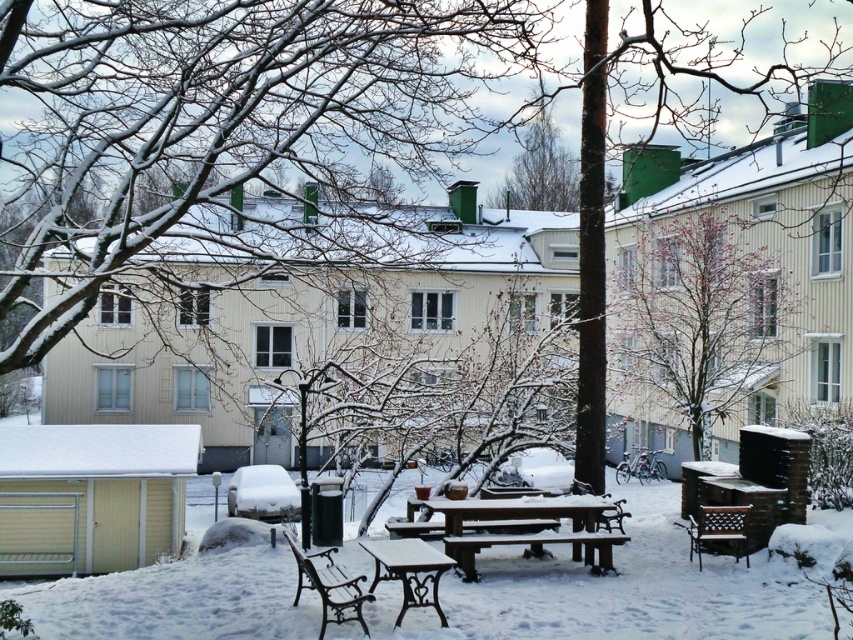
Is point (764, 244) farther from viewer compared to point (590, 502)?

That is True.

Identify the location of bare wood tree at center. (695, 326).

This screenshot has height=640, width=853. I want to click on bare wood tree at center, so click(x=695, y=326).

Can you confirm if white painted wood table at center is positioned to the right of brown woven chair at lower right?

No, white painted wood table at center is not to the right of brown woven chair at lower right.

Locate an element on the screen. The width and height of the screenshot is (853, 640). white painted wood table at center is located at coordinates (409, 570).

Which is in front, point (445, 563) or point (743, 532)?

Point (445, 563) is more forward.

The image size is (853, 640). I want to click on white painted wood table at center, so click(x=409, y=570).

Which of these two, bare wood tree at center or bronze metal bench at lower center, stands taller?

bare wood tree at center

In the scene shown: Can you confirm if bare wood tree at center is shorter than bronze metal bench at lower center?

No.

Who is more distant from viewer, (788, 275) or (338, 602)?

The point (788, 275) is behind.

The height and width of the screenshot is (640, 853). Identify the location of bare wood tree at center. (695, 326).